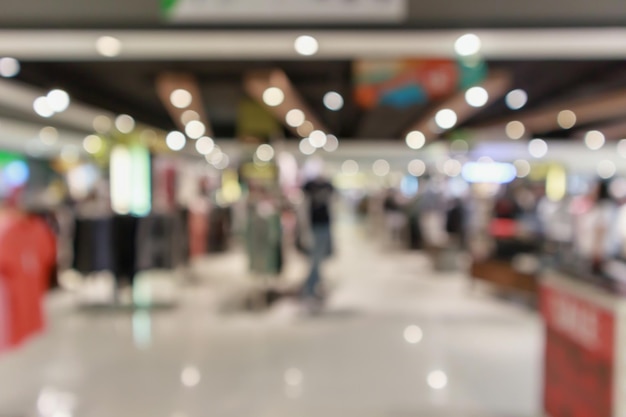
Locate an element on the screen. light is located at coordinates click(297, 111), click(466, 100), click(191, 128), click(106, 46), click(495, 172), click(136, 193), click(580, 174).